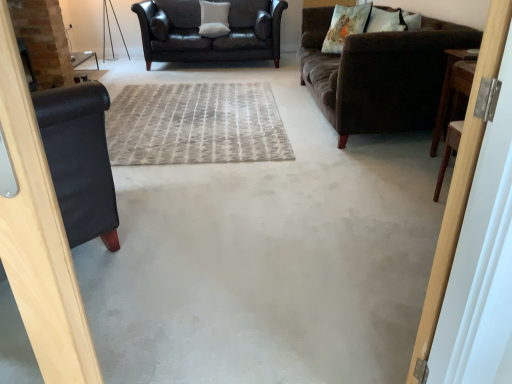
The height and width of the screenshot is (384, 512). In order to click on free space to the left of brown velvety couch at upper right, placed as the second studio couch when sorted from left to right in this screenshot , I will do `click(219, 112)`.